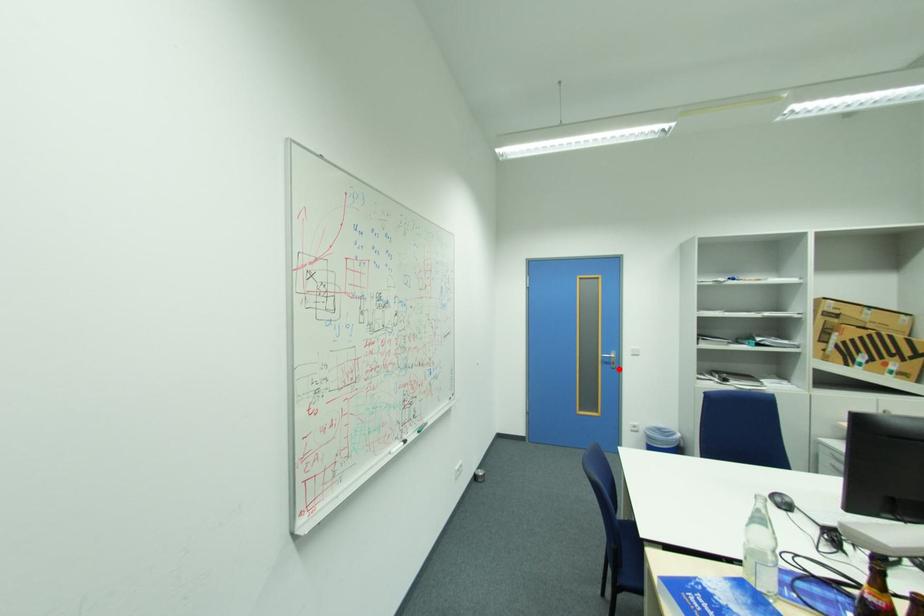
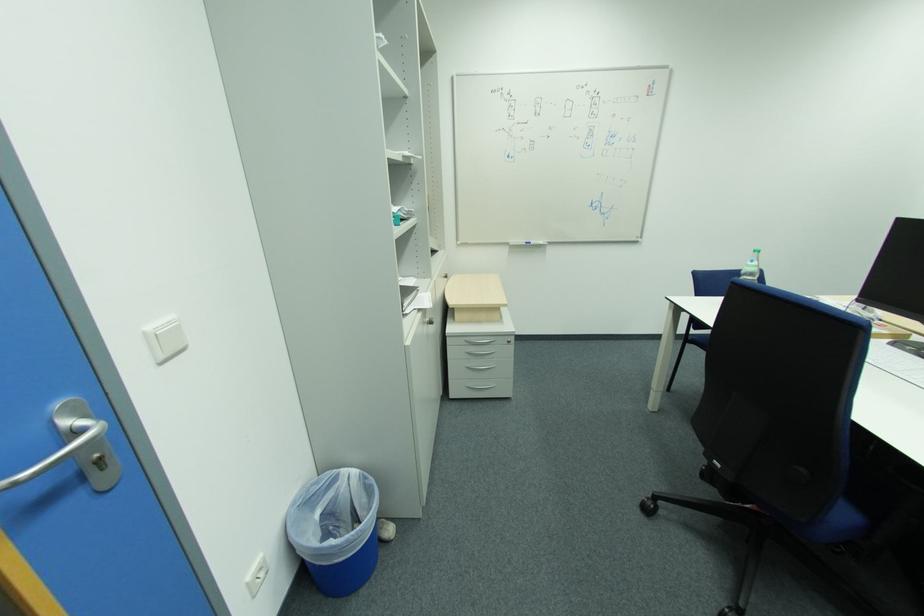
The point at the highlighted location is marked in the first image. Where is the corresponding point in the second image?

(111, 488)